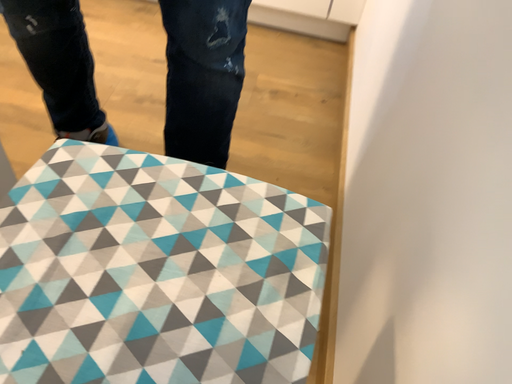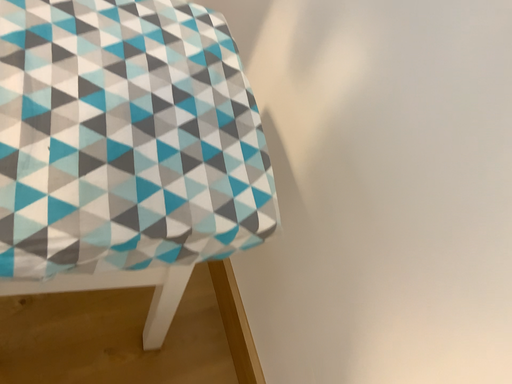
Question: Which way did the camera rotate in the video?

Choices:
 (A) rotated downward
 (B) rotated upward

Answer: (A)